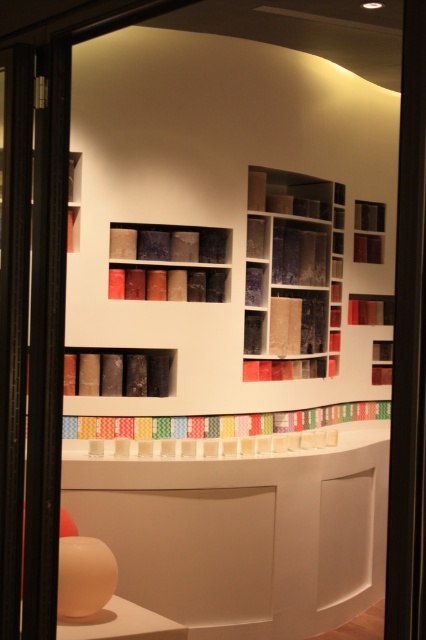
Can you confirm if textured fabric at center is thinner than matte black bookshelf at center?

No, textured fabric at center is not thinner than matte black bookshelf at center.

Does textured fabric at center appear on the left side of matte black bookshelf at center?

Incorrect, textured fabric at center is not on the left side of matte black bookshelf at center.

Who is more distant from viewer, (322, 252) or (111, 250)?

The point (322, 252) is behind.

Find the location of a particular element. textured fabric at center is located at coordinates (293, 275).

Does point (132, 268) come farther from viewer compared to point (141, 381)?

Yes.

Is matte black bookshelf at center thinner than matte black tubes at center?

Incorrect, matte black bookshelf at center's width is not less than matte black tubes at center's.

Is point (124, 291) more distant than point (91, 376)?

That is True.

The height and width of the screenshot is (640, 426). Find the location of `matte black bookshelf at center`. matte black bookshelf at center is located at coordinates (169, 262).

Can you confirm if textured fabric at center is positioned to the right of transparent glass door at left?

Indeed, textured fabric at center is positioned on the right side of transparent glass door at left.

Between textured fabric at center and transparent glass door at left, which one has more height?

transparent glass door at left is taller.

Is point (316, 198) positioned after point (22, 342)?

Yes, it is behind point (22, 342).

Image resolution: width=426 pixels, height=640 pixels. Find the location of `textured fabric at center`. textured fabric at center is located at coordinates (293, 275).